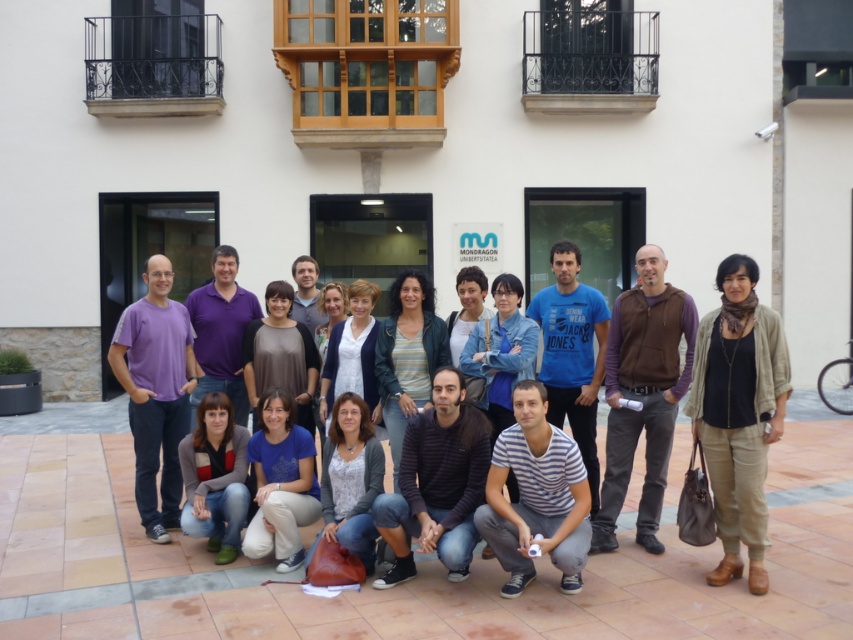
Is the position of blue cotton t-shirt at center more distant than that of white matte jacket at center?

No, it is not.

Which is behind, point (601, 301) or point (358, 349)?

Positioned behind is point (601, 301).

Does point (561, 307) come behind point (357, 307)?

No.

I want to click on blue cotton t-shirt at center, so pyautogui.click(x=572, y=353).

Who is taller, purple cotton t-shirt at left or purple cotton polo shirt at center?

Standing taller between the two is purple cotton t-shirt at left.

How much distance is there between purple cotton t-shirt at left and purple cotton polo shirt at center?

purple cotton t-shirt at left is 15.85 inches from purple cotton polo shirt at center.

Image resolution: width=853 pixels, height=640 pixels. What are the coordinates of `purple cotton t-shirt at left` in the screenshot? It's located at point(155,392).

Between blue cotton t-shirt at center and striped knit sweater at center, which one is positioned lower?

blue cotton t-shirt at center

Measure the distance from blue cotton t-shirt at center to striped knit sweater at center.

blue cotton t-shirt at center and striped knit sweater at center are 3.34 feet apart from each other.

Does point (587, 289) lie in front of point (434, 340)?

No, it is not.

Locate an element on the screen. This screenshot has width=853, height=640. blue cotton t-shirt at center is located at coordinates point(572,353).